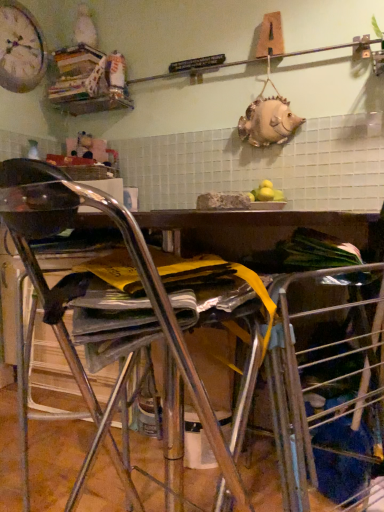
Question: Considering the relative positions of wooden bookshelf at upper left and metallic silver chair at center in the image provided, is wooden bookshelf at upper left to the left of metallic silver chair at center from the viewer's perspective?

Choices:
 (A) no
 (B) yes

Answer: (B)

Question: Can you confirm if wooden bookshelf at upper left is smaller than metallic silver chair at center?

Choices:
 (A) no
 (B) yes

Answer: (B)

Question: Is the surface of wooden bookshelf at upper left in direct contact with metallic silver chair at center?

Choices:
 (A) yes
 (B) no

Answer: (B)

Question: From the image's perspective, would you say wooden bookshelf at upper left is positioned over metallic silver chair at center?

Choices:
 (A) yes
 (B) no

Answer: (A)

Question: Can you confirm if wooden bookshelf at upper left is thinner than metallic silver chair at center?

Choices:
 (A) yes
 (B) no

Answer: (A)

Question: From the image's perspective, is wooden bookshelf at upper left under metallic silver chair at center?

Choices:
 (A) yes
 (B) no

Answer: (B)

Question: Is matte white clock at upper left with metallic silver chair at center?

Choices:
 (A) no
 (B) yes

Answer: (A)

Question: Is matte white clock at upper left at the right side of metallic silver chair at center?

Choices:
 (A) no
 (B) yes

Answer: (A)

Question: From a real-world perspective, is matte white clock at upper left over metallic silver chair at center?

Choices:
 (A) no
 (B) yes

Answer: (B)

Question: Would you consider matte white clock at upper left to be distant from metallic silver chair at center?

Choices:
 (A) no
 (B) yes

Answer: (B)

Question: Considering the relative sizes of matte white clock at upper left and metallic silver chair at center in the image provided, is matte white clock at upper left bigger than metallic silver chair at center?

Choices:
 (A) no
 (B) yes

Answer: (A)

Question: Is matte white clock at upper left further to camera compared to metallic silver chair at center?

Choices:
 (A) no
 (B) yes

Answer: (B)

Question: Is wooden bookshelf at upper left positioned far away from matte white clock at upper left?

Choices:
 (A) yes
 (B) no

Answer: (B)